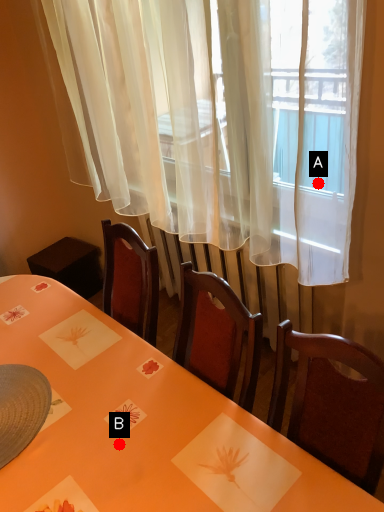
Question: Two points are circled on the image, labeled by A and B beside each circle. Which of the following is the farthest from the observer?

Choices:
 (A) A is further
 (B) B is further

Answer: (A)